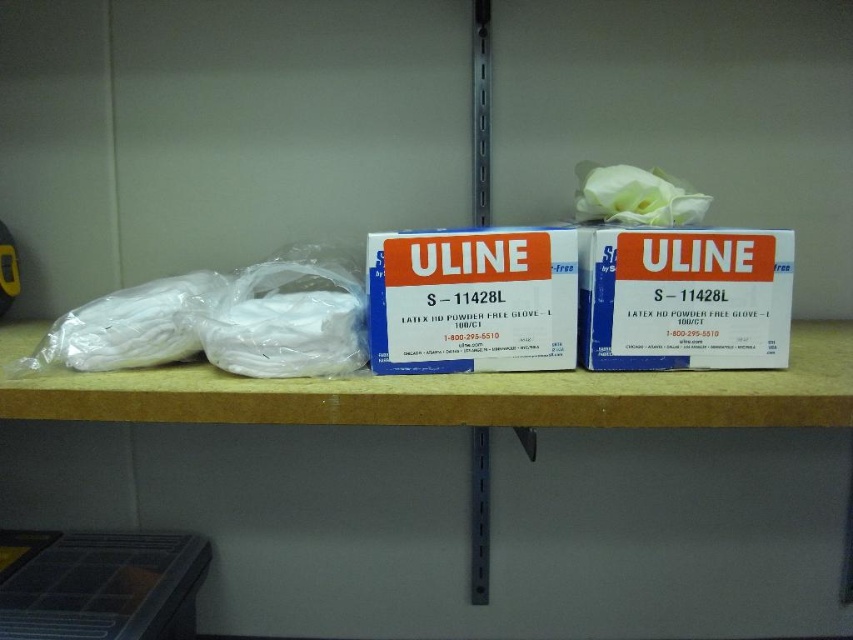
Question: Which point is farther to the camera?

Choices:
 (A) (12, 369)
 (B) (178, 376)
 (C) (252, 282)

Answer: (C)

Question: Which of these objects is positioned farthest from the white plastic gloves at center?

Choices:
 (A) white matte plastic at left
 (B) white matte box at center

Answer: (A)

Question: Is white matte box at center thinner than white matte plastic at left?

Choices:
 (A) no
 (B) yes

Answer: (B)

Question: Which object is the closest to the translucent plastic bag at left?

Choices:
 (A) white plastic gloves at center
 (B) white matte box at center
 (C) blue cardboard box at center
 (D) white matte plastic at left

Answer: (D)

Question: Is white matte box at center behind blue cardboard box at center?

Choices:
 (A) no
 (B) yes

Answer: (A)

Question: Can you confirm if white plastic gloves at center is bigger than blue cardboard box at center?

Choices:
 (A) no
 (B) yes

Answer: (B)